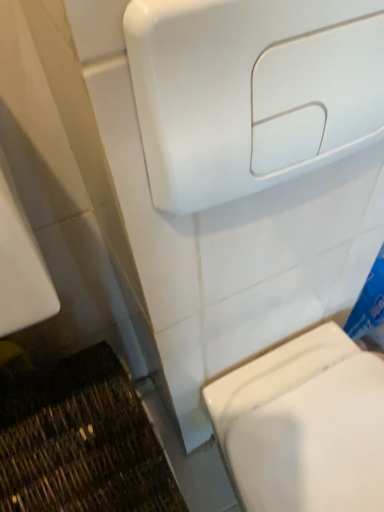
Question: In terms of width, does white glossy hand dryer at upper center look wider or thinner when compared to white glossy toilet at lower right?

Choices:
 (A) thin
 (B) wide

Answer: (A)

Question: Is white glossy hand dryer at upper center inside or outside of white glossy toilet at lower right?

Choices:
 (A) outside
 (B) inside

Answer: (A)

Question: In terms of height, does white glossy hand dryer at upper center look taller or shorter compared to white glossy toilet at lower right?

Choices:
 (A) tall
 (B) short

Answer: (B)

Question: Is white glossy toilet at lower right bigger or smaller than white glossy hand dryer at upper center?

Choices:
 (A) small
 (B) big

Answer: (B)

Question: In the image, is white glossy toilet at lower right on the left side or the right side of white glossy hand dryer at upper center?

Choices:
 (A) left
 (B) right

Answer: (B)

Question: Is point (271, 495) positioned closer to the camera than point (190, 90)?

Choices:
 (A) closer
 (B) farther

Answer: (B)

Question: From the image's perspective, is white glossy toilet at lower right positioned above or below white glossy hand dryer at upper center?

Choices:
 (A) below
 (B) above

Answer: (A)